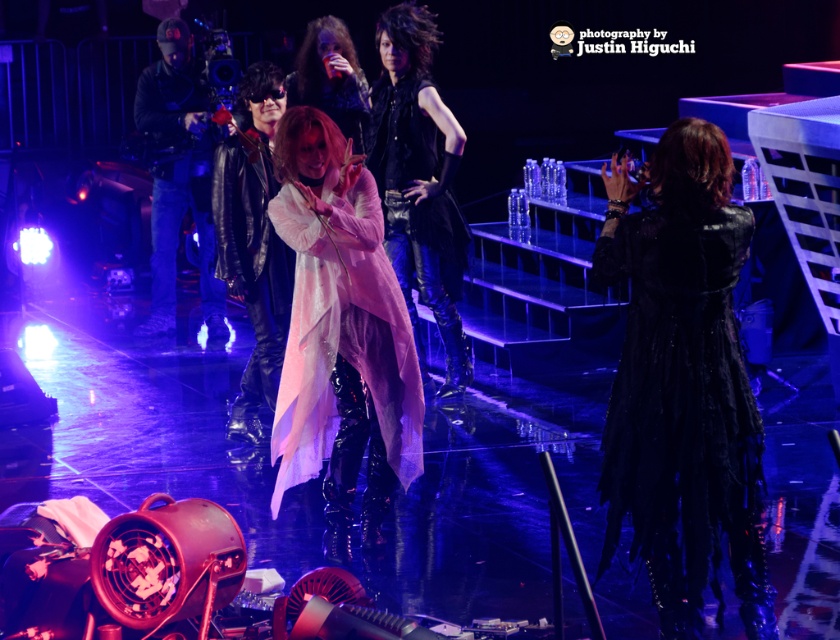
Is pink matte coat at center to the left of shiny black hair at upper center from the viewer's perspective?

Incorrect, pink matte coat at center is not on the left side of shiny black hair at upper center.

Can you confirm if pink matte coat at center is smaller than shiny black hair at upper center?

No, pink matte coat at center is not smaller than shiny black hair at upper center.

Measure the distance between pink matte coat at center and camera.

A distance of 8.02 meters exists between pink matte coat at center and camera.

What are the coordinates of `pink matte coat at center` in the screenshot? It's located at (420, 180).

Which is in front, point (211, 268) or point (344, 67)?

Point (344, 67) is in front.

You are a GUI agent. You are given a task and a screenshot of the screen. Output one action in this format:
    pyautogui.click(x=<x>, y=<y>)
    Task: Click on the matte black camera at left
    
    Given the screenshot: What is the action you would take?
    pyautogui.click(x=177, y=177)

Does shiny pink fabric dress at center have a lesser width compared to shiny black hair at upper center?

Incorrect, shiny pink fabric dress at center's width is not less than shiny black hair at upper center's.

Does shiny pink fabric dress at center have a smaller size compared to shiny black hair at upper center?

No.

Where is `shiny pink fabric dress at center`? The width and height of the screenshot is (840, 640). shiny pink fabric dress at center is located at coordinates (342, 333).